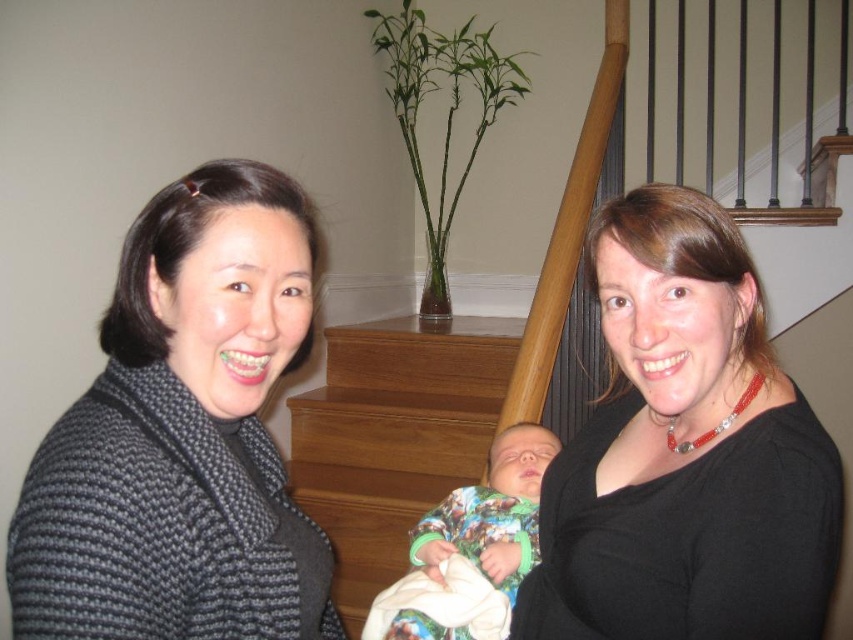
You are standing in the room and want to take a photo of the knitted gray sweater at left. Where should you position yourself to capture it in the frame?

To capture the knitted gray sweater at left in the frame, position yourself facing the left side of the room, as the knitted gray sweater at left is located at point [183,436] which corresponds to the left area of the image.

You are standing in the living room and want to take a photo of the black matte shirt at right and the wooden stairs at center. Which object will appear larger in the photo?

The black matte shirt at right will appear larger in the photo because it is closer to the viewer than the wooden stairs at center.

Please look at the point marked at coordinates (685,452). What object is located there?

The black matte shirt at right is located at point (685,452).